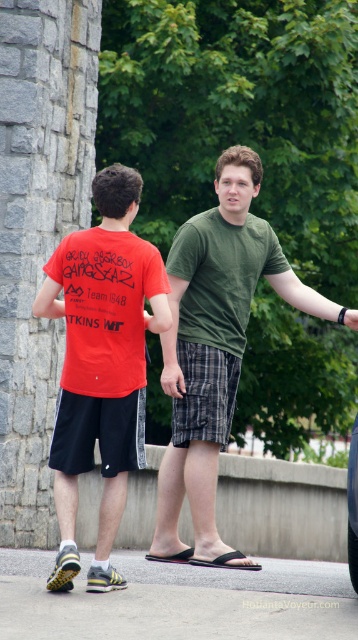
You are standing in the scene and want to move from the point at coordinates point (182, 250) to the point at coordinates point (65, 410). Which direction should you move to get closer to the camera?

To move from point (182, 250) to point (65, 410), you should move downward and to the right because point (65, 410) is located at a lower and more rightward position compared to point (182, 250).

You are standing at the point with coordinates point (144, 316) and want to walk to the point with coordinates point (355, 428). Which direction should you move to get closer to your destination?

To move from point (144, 316) to point (355, 428), you should move towards the upper right direction since point (355, 428) is located to the upper right of point (144, 316).